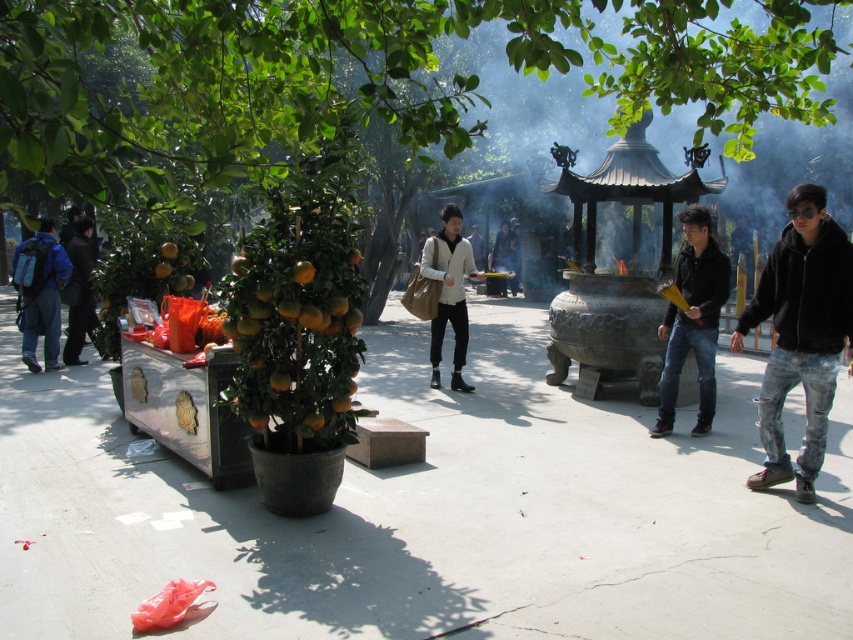
Question: Which object is closer to the camera taking this photo?

Choices:
 (A) black fuzzy jacket at right
 (B) matte blue backpack at left
 (C) green glossy tree at center

Answer: (C)

Question: Is green glossy tree at center closer to the viewer compared to black fuzzy jacket at right?

Choices:
 (A) no
 (B) yes

Answer: (B)

Question: Which of the following is the closest to the observer?

Choices:
 (A) matte beige jacket at center
 (B) black fuzzy jacket at right

Answer: (B)

Question: Is black fuzzy jacket at right positioned before matte beige jacket at center?

Choices:
 (A) yes
 (B) no

Answer: (A)

Question: Which point is closer to the camera?

Choices:
 (A) (782, 387)
 (B) (39, 305)

Answer: (A)

Question: Can you confirm if green glossy tree at center is positioned to the left of black fuzzy jacket at right?

Choices:
 (A) yes
 (B) no

Answer: (A)